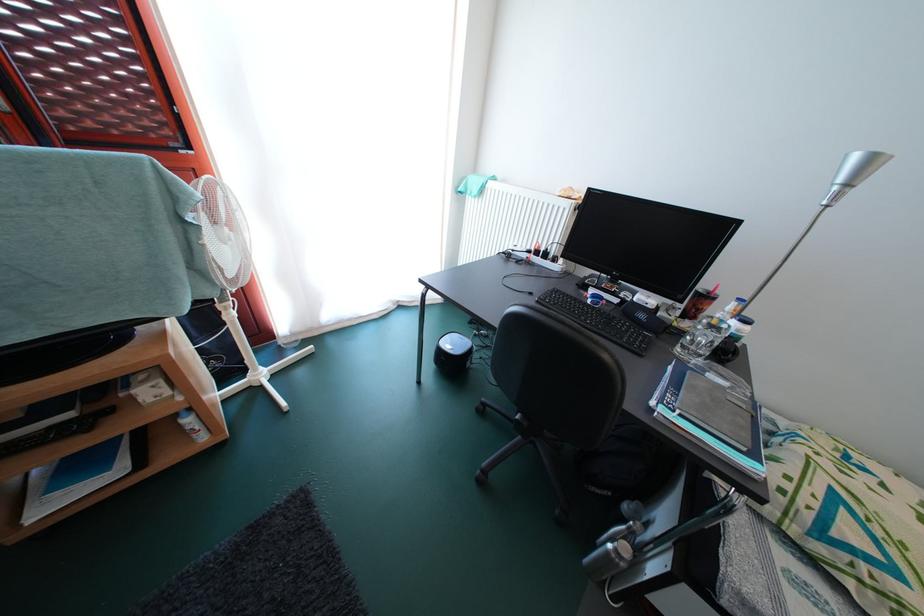
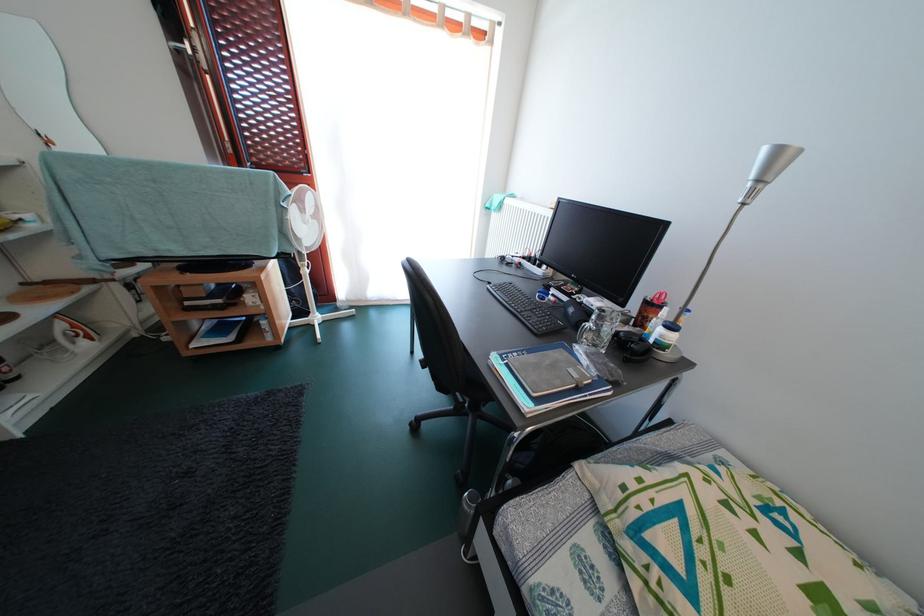
In the second image, find the point that corresponds to (511,187) in the first image.

(529, 204)